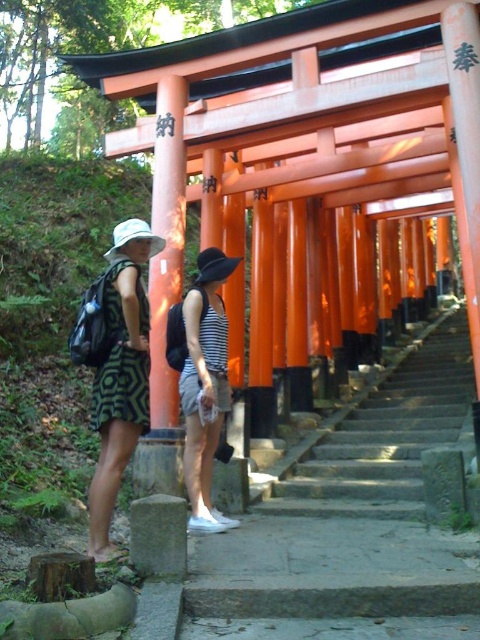
Does smooth stone stairs at center come in front of green patterned dress at left?

Yes.

Locate an element on the screen. The image size is (480, 640). smooth stone stairs at center is located at coordinates (350, 524).

Which is below, stone stairs at center or green patterned dress at left?

stone stairs at center is below.

Is stone stairs at center smaller than green patterned dress at left?

Actually, stone stairs at center might be larger than green patterned dress at left.

You are a GUI agent. You are given a task and a screenshot of the screen. Output one action in this format:
    pyautogui.click(x=<x>, y=<y>)
    Task: Click on the stone stairs at center
    Image resolution: width=480 pixels, height=640 pixels.
    Given the screenshot: What is the action you would take?
    pyautogui.click(x=385, y=436)

Is green patterned dress at left above striped cotton tank top at center?

Indeed, green patterned dress at left is positioned over striped cotton tank top at center.

Is green patterned dress at left below striped cotton tank top at center?

No, green patterned dress at left is not below striped cotton tank top at center.

The height and width of the screenshot is (640, 480). I want to click on green patterned dress at left, so click(120, 376).

Image resolution: width=480 pixels, height=640 pixels. Find the location of `green patterned dress at left`. green patterned dress at left is located at coordinates (120, 376).